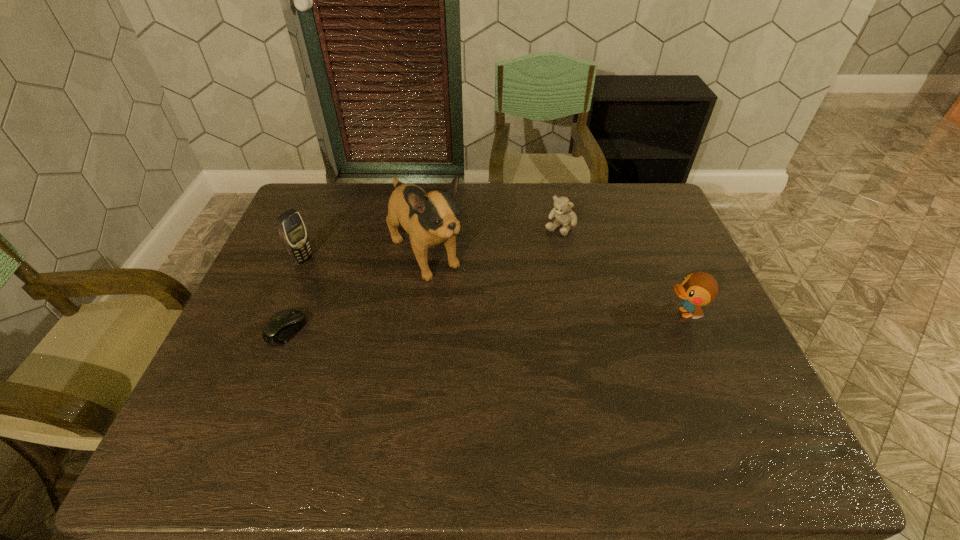
Where is `blank region between the cellular telephone and the third object from left to right`? The height and width of the screenshot is (540, 960). blank region between the cellular telephone and the third object from left to right is located at coordinates (364, 257).

Locate an element on the screen. This screenshot has width=960, height=540. vacant space in between the rightmost object and the mouse is located at coordinates (485, 321).

This screenshot has width=960, height=540. Find the location of `vacant region between the duck and the fourth tallest object`. vacant region between the duck and the fourth tallest object is located at coordinates (622, 270).

Image resolution: width=960 pixels, height=540 pixels. I want to click on empty space that is in between the second tallest object and the puppy, so click(364, 257).

Where is `vacant space that's between the shortest object and the fourth shortest object`? This screenshot has width=960, height=540. vacant space that's between the shortest object and the fourth shortest object is located at coordinates (295, 295).

You are a GUI agent. You are given a task and a screenshot of the screen. Output one action in this format:
    pyautogui.click(x=<x>, y=<y>)
    Task: Click on the free space between the rightmost object and the tallest object
    Image resolution: width=960 pixels, height=540 pixels.
    Given the screenshot: What is the action you would take?
    pyautogui.click(x=554, y=284)

The image size is (960, 540). Identify the location of vacant area between the second shortest object and the duck. (622, 270).

Image resolution: width=960 pixels, height=540 pixels. What are the coordinates of `free space between the second shortest object and the puppy` in the screenshot? It's located at (492, 241).

Where is `blank region between the mouse and the rightmost object`? The image size is (960, 540). blank region between the mouse and the rightmost object is located at coordinates (485, 321).

In order to click on object that stands as the closest to the second shortest object in this screenshot , I will do `click(430, 219)`.